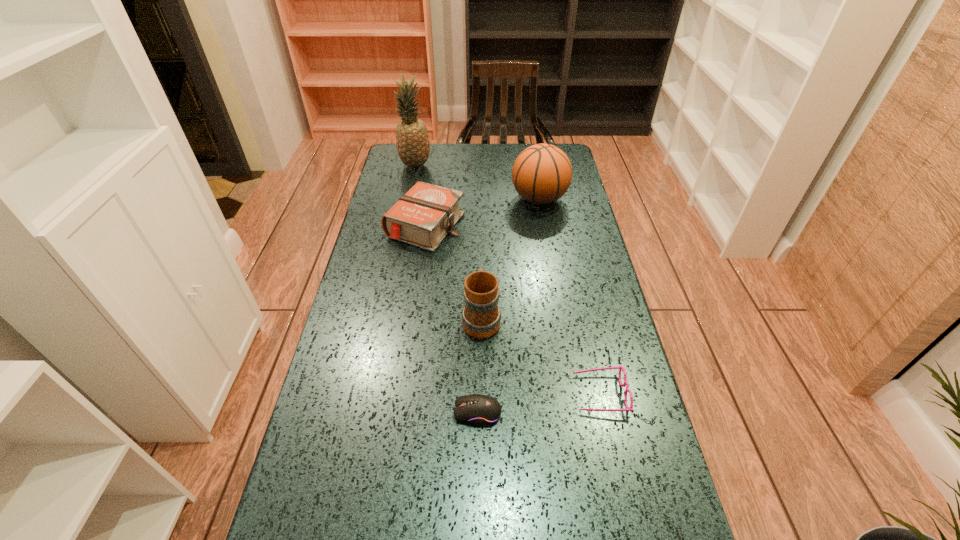
I want to click on the tallest object, so click(x=412, y=139).

Identify the location of pineapple. This screenshot has width=960, height=540. (412, 139).

Identify the location of the fifth shortest object. (542, 173).

Find the location of `mug`. mug is located at coordinates (481, 316).

Locate an element on the screen. This screenshot has width=960, height=540. the fourth shortest object is located at coordinates coord(481,316).

You are a GUI agent. You are given a task and a screenshot of the screen. Output one action in this format:
    pyautogui.click(x=<x>, y=<y>)
    Task: Click on the fourth tallest object
    Image resolution: width=960 pixels, height=540 pixels.
    Given the screenshot: What is the action you would take?
    pyautogui.click(x=422, y=217)

Find the location of a particular element. The width and height of the screenshot is (960, 540). spectacles is located at coordinates (619, 367).

This screenshot has height=540, width=960. What are the coordinates of `computer mouse` in the screenshot? It's located at (482, 410).

Identify the location of free spot located 0.380m on the right of the pineapple. (523, 165).

Image resolution: width=960 pixels, height=540 pixels. Identify the location of vacant position located on the front of the second tallest object. (552, 275).